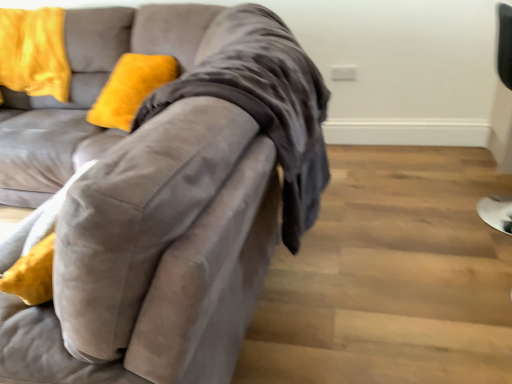
Question: Considering the relative sizes of velvet yellow pillow at upper left and velvet gray couch at left in the image provided, is velvet yellow pillow at upper left thinner than velvet gray couch at left?

Choices:
 (A) no
 (B) yes

Answer: (B)

Question: Does velvet yellow pillow at upper left have a lesser height compared to velvet gray couch at left?

Choices:
 (A) yes
 (B) no

Answer: (A)

Question: Would you say velvet yellow pillow at upper left is outside velvet gray couch at left?

Choices:
 (A) yes
 (B) no

Answer: (B)

Question: From the image's perspective, is velvet yellow pillow at upper left above velvet gray couch at left?

Choices:
 (A) no
 (B) yes

Answer: (B)

Question: From a real-world perspective, is velvet yellow pillow at upper left positioned under velvet gray couch at left based on gravity?

Choices:
 (A) no
 (B) yes

Answer: (A)

Question: Is velvet yellow pillow at upper left oriented towards velvet gray couch at left?

Choices:
 (A) no
 (B) yes

Answer: (B)

Question: Does black leather chair at right have a smaller size compared to velvet yellow pillow at upper left?

Choices:
 (A) yes
 (B) no

Answer: (B)

Question: Is black leather chair at right at the left side of velvet yellow pillow at upper left?

Choices:
 (A) no
 (B) yes

Answer: (A)

Question: Does black leather chair at right lie in front of velvet yellow pillow at upper left?

Choices:
 (A) no
 (B) yes

Answer: (B)

Question: Does black leather chair at right appear on the right side of velvet yellow pillow at upper left?

Choices:
 (A) no
 (B) yes

Answer: (B)

Question: Is black leather chair at right behind velvet yellow pillow at upper left?

Choices:
 (A) no
 (B) yes

Answer: (A)

Question: Could you tell me if black leather chair at right is turned towards velvet yellow pillow at upper left?

Choices:
 (A) no
 (B) yes

Answer: (A)

Question: Is velvet yellow pillow at upper left shorter than black leather chair at right?

Choices:
 (A) yes
 (B) no

Answer: (A)